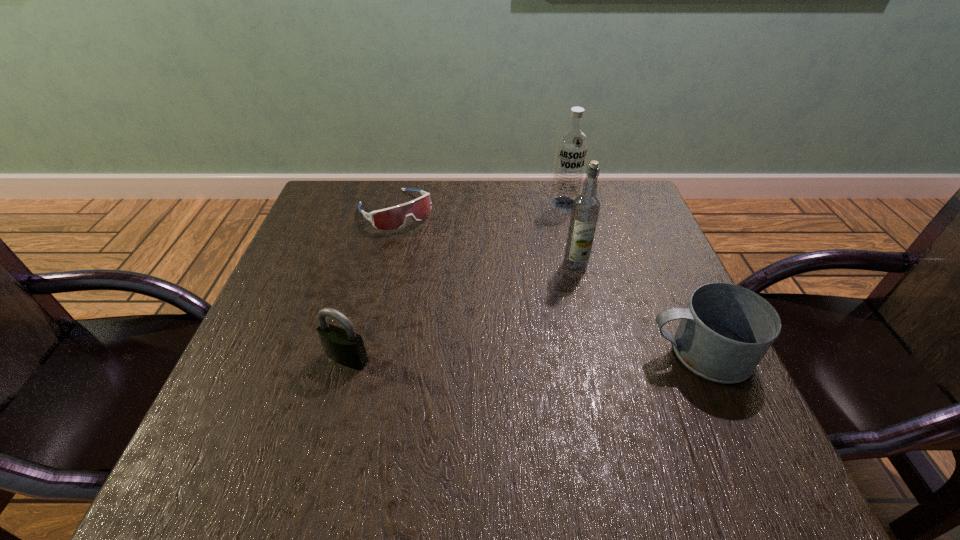
Locate an element on the screen. blank area in the image that satisfies the following two spatial constraints: 1. on the front side of the nearer vodka; 2. on the right side of the goggles is located at coordinates (382, 265).